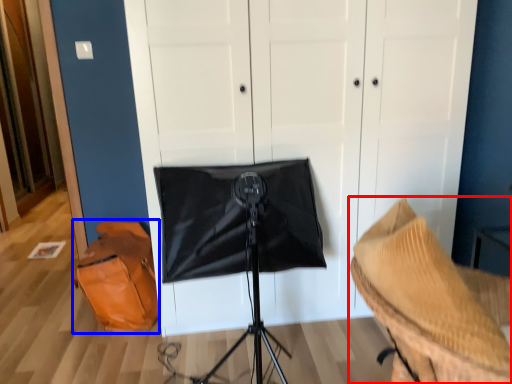
Question: Which point is further to the camera, furniture (highlighted by a red box) or messenger bag (highlighted by a blue box)?

Choices:
 (A) furniture
 (B) messenger bag

Answer: (B)